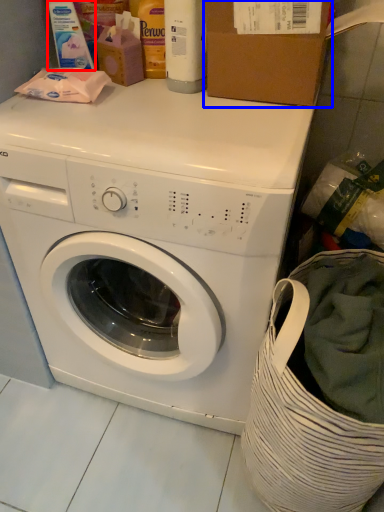
Question: Which point is further to the camera, cleaning product (highlighted by a red box) or cardboard box (highlighted by a blue box)?

Choices:
 (A) cleaning product
 (B) cardboard box

Answer: (A)